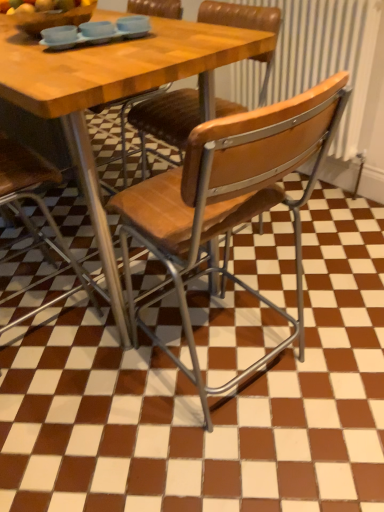
In order to click on free point to the right of wooden seat at center, positioned as the first chair in right-to-left order in this screenshot , I will do `click(343, 307)`.